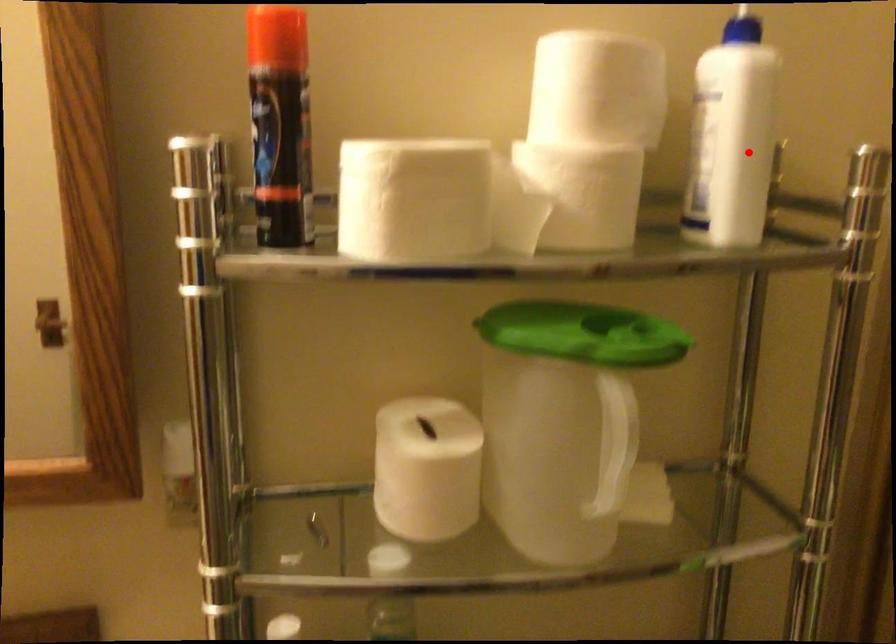
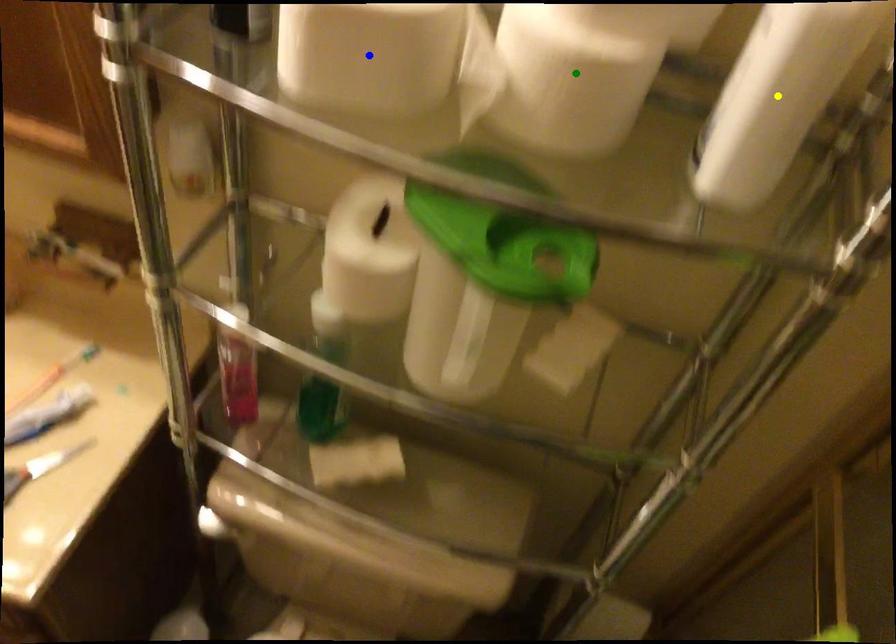
Question: I am providing you with two images of the same scene from different viewpoints. A red point is marked on the first image. You are given multiple points on the second image. Which spot in image 2 lines up with the point in image 1?

Choices:
 (A) yellow point
 (B) green point
 (C) blue point

Answer: (A)